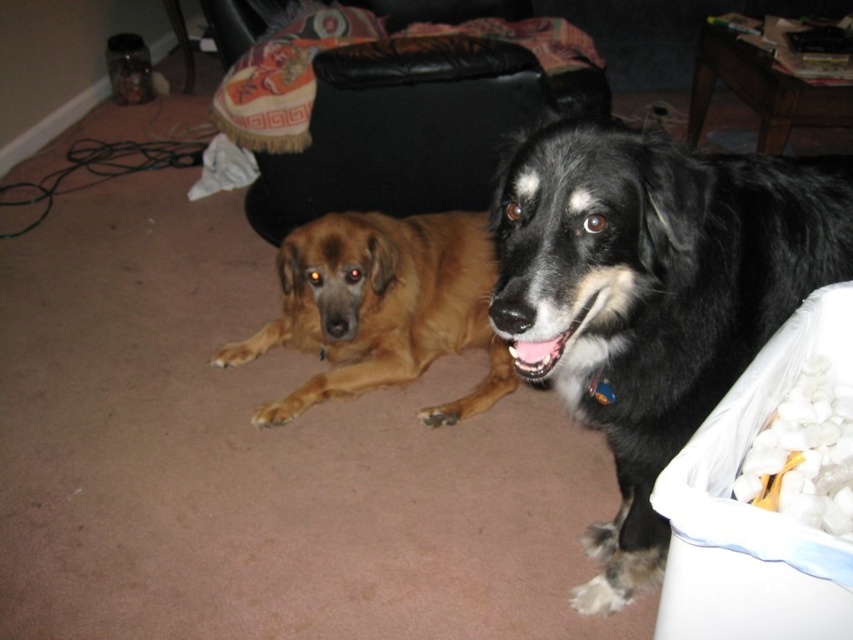
You are a dog trainer who wants to place a treat between the black fur dog at right and the brown furry dog at center. The treat is 10 inches in diameter. Is there enough space between them to place the treat without it overlapping either dog?

The black fur dog at right and the brown furry dog at center are 32.02 inches apart from each other. Since the treat is 10 inches in diameter, there is sufficient space between them to place the treat without overlapping either dog.